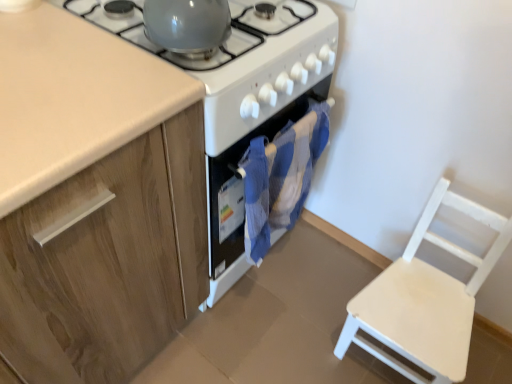
Locate an element on the screen. This screenshot has width=512, height=384. vacant space situated above wooden cabinet at left (from a real-world perspective) is located at coordinates (55, 74).